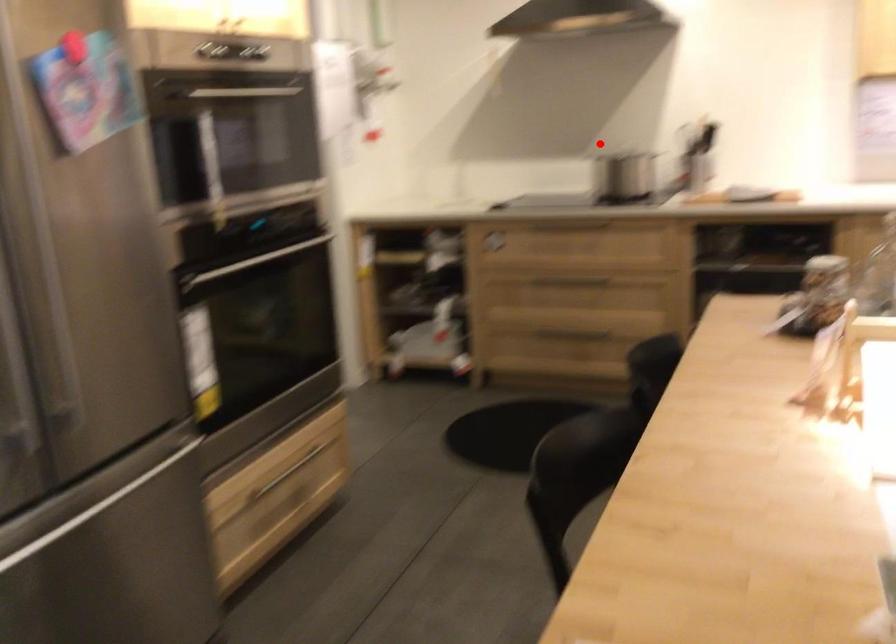
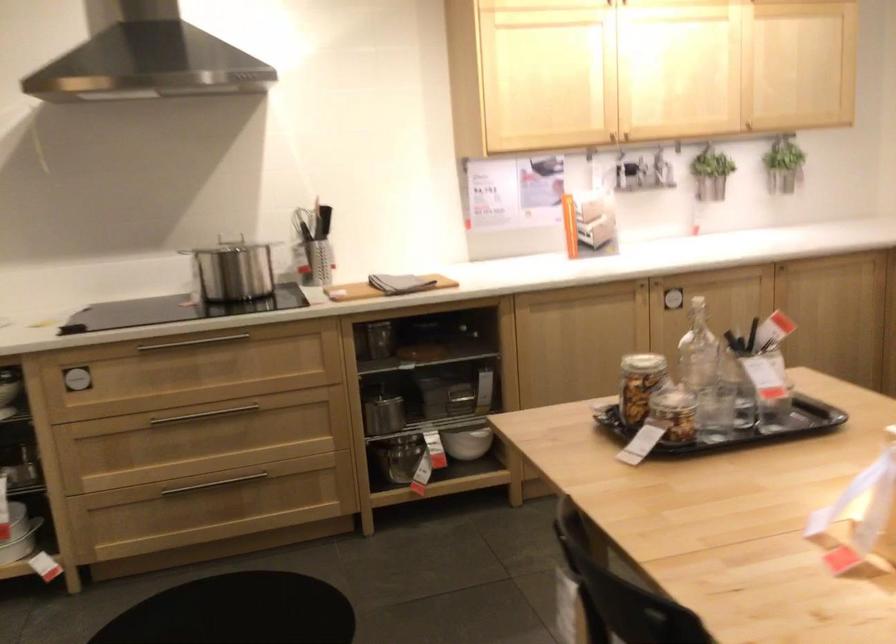
Question: I am providing you with two images of the same scene from different viewpoints. Image1 has a red point marked. In image2, the corresponding 3D location appears at what relative position? Reply with the corresponding letter.

Choices:
 (A) Closer
 (B) Farther

Answer: (A)